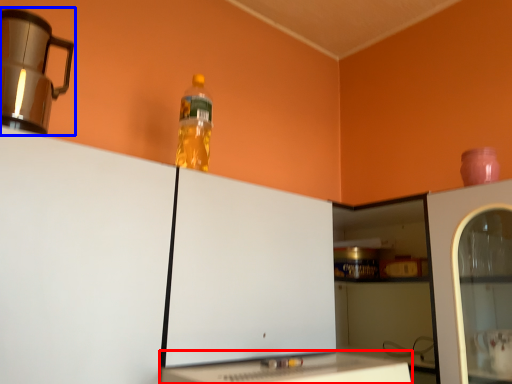
Question: Which object is further to the camera taking this photo, table (highlighted by a red box) or home appliance (highlighted by a blue box)?

Choices:
 (A) table
 (B) home appliance

Answer: (B)